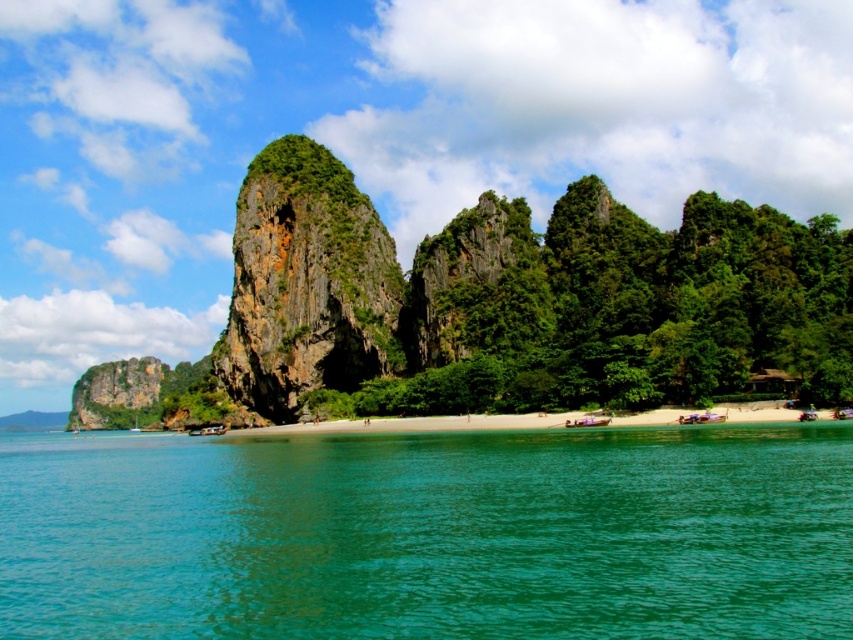
You are standing on the beach and want to take a photo of both the green water at lower center and the green textured rock at center. Which object should you focus on first if you want both to be in clear focus?

The green water at lower center has a lesser height compared to the green textured rock at center, so you should focus on the green textured rock at center first to ensure both are in clear focus.

You are a geologist examining the tropical beach scene. You need to locate the green textured rock at center. According to the coordinates provided, where would you find it in the image?

The green textured rock at center is located at point coordinates of (306, 284).